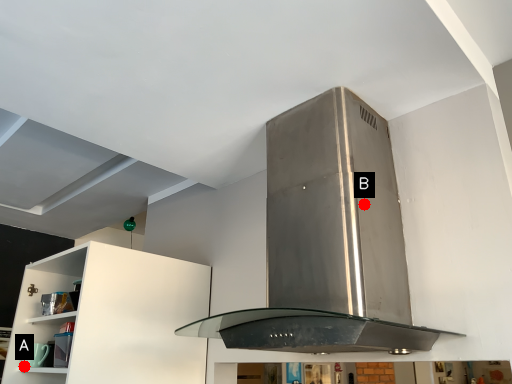
Question: Two points are circled on the image, labeled by A and B beside each circle. Which point is farther from the camera taking this photo?

Choices:
 (A) A is further
 (B) B is further

Answer: (A)